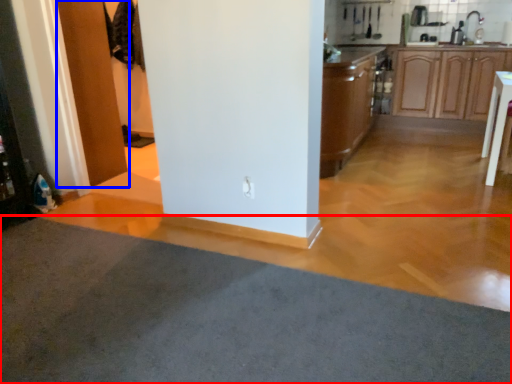
Question: Which point is closer to the camera, plain (highlighted by a red box) or door (highlighted by a blue box)?

Choices:
 (A) plain
 (B) door

Answer: (A)